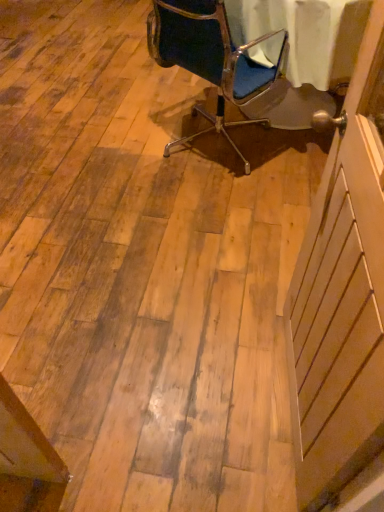
Where is `blank area to the left of white wood screen door at right`? The height and width of the screenshot is (512, 384). blank area to the left of white wood screen door at right is located at coordinates (174, 386).